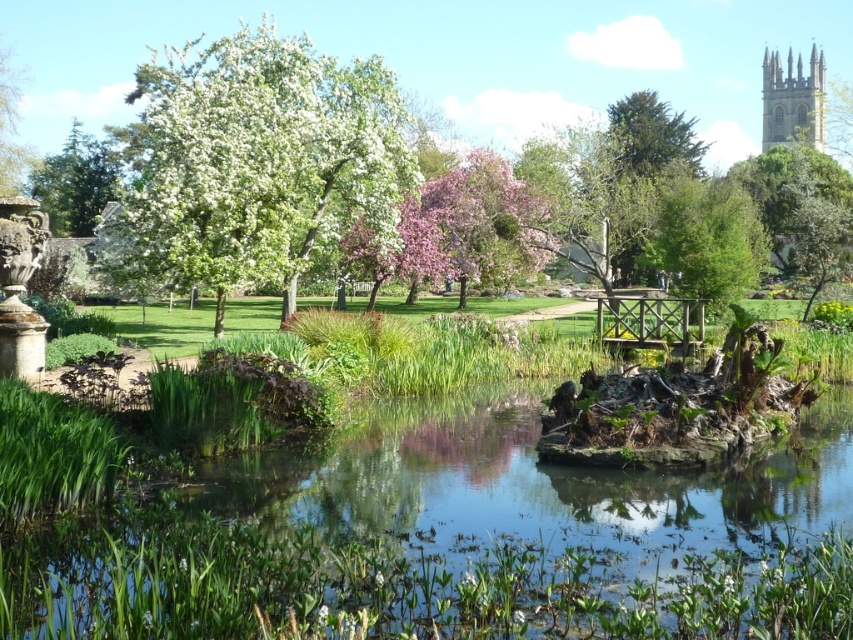
Question: Can you confirm if white blossoming tree at upper left is positioned to the right of green textured tree at upper left?

Choices:
 (A) no
 (B) yes

Answer: (B)

Question: Where is white blossoming tree at upper left located in relation to stone tower at upper right in the image?

Choices:
 (A) left
 (B) right

Answer: (A)

Question: Which is farther from the stone tower at upper right?

Choices:
 (A) white blossoming tree at upper left
 (B) green textured tree at upper left

Answer: (A)

Question: Estimate the real-world distances between objects in this image. Which object is closer to the stone tower at upper right?

Choices:
 (A) green textured tree at upper left
 (B) white blossoming tree at upper left
 (C) clear water at center

Answer: (A)

Question: Which of the following is the farthest from the observer?

Choices:
 (A) stone tower at upper right
 (B) green textured tree at upper left
 (C) white blossoming tree at upper left

Answer: (A)

Question: Does green textured tree at upper left appear on the right side of stone tower at upper right?

Choices:
 (A) no
 (B) yes

Answer: (A)